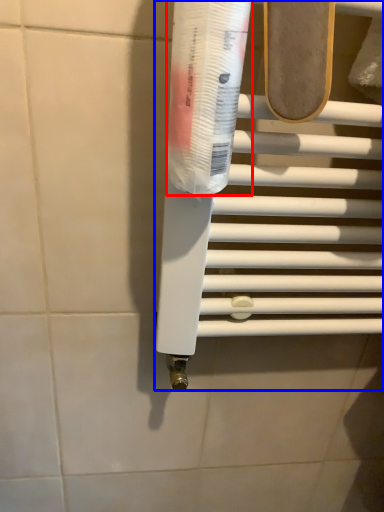
Question: Which object appears farthest to the camera in this image, toothpaste (highlighted by a red box) or towel bar (highlighted by a blue box)?

Choices:
 (A) toothpaste
 (B) towel bar

Answer: (B)